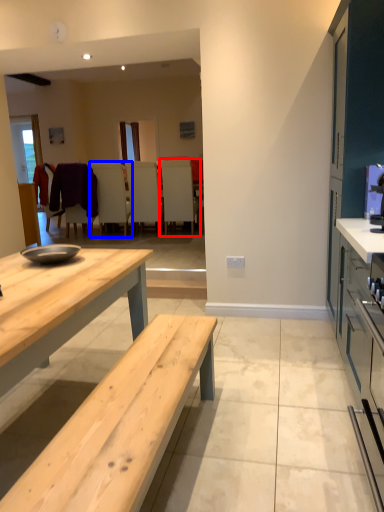
Question: Which object is further to the camera taking this photo, chair (highlighted by a red box) or chair (highlighted by a blue box)?

Choices:
 (A) chair
 (B) chair

Answer: (B)